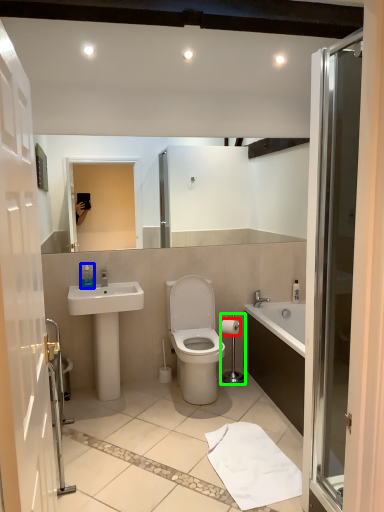
Question: Estimate the real-world distances between objects in this image. Which object is farther from toilet paper (highlighted by a red box), toiletry (highlighted by a blue box) or towel bar (highlighted by a green box)?

Choices:
 (A) toiletry
 (B) towel bar

Answer: (A)